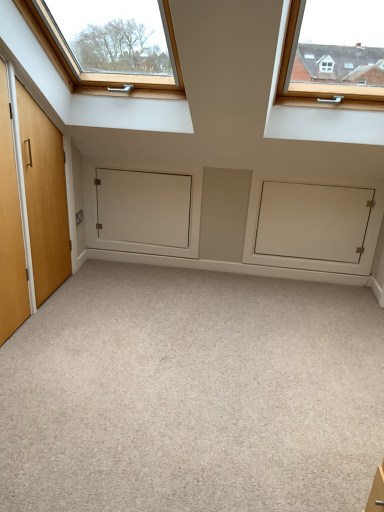
Describe the element at coordinates (143, 207) in the screenshot. I see `white matte door at center` at that location.

Where is `white matte cabinet at center`? This screenshot has height=512, width=384. white matte cabinet at center is located at coordinates (313, 221).

Could white matte cabinet at center be considered to be inside white matte door at center?

No, white matte cabinet at center is located outside of white matte door at center.

Can you tell me how much white matte door at center and white matte cabinet at center differ in facing direction?

They differ by 0.00222 degrees in their facing directions.

Is white matte door at center smaller than white matte cabinet at center?

Yes.

In terms of height, does white matte door at center look taller or shorter compared to white matte cabinet at center?

Clearly, white matte door at center is shorter compared to white matte cabinet at center.

Considering the sizes of objects white matte cabinet at center and carpet at center in the image provided, who is smaller, white matte cabinet at center or carpet at center?

white matte cabinet at center is smaller.

Can you tell me how much white matte cabinet at center and carpet at center differ in facing direction?

There is a 89.4-degree angle between the facing directions of white matte cabinet at center and carpet at center.

Considering the sizes of objects white matte cabinet at center and carpet at center in the image provided, who is wider, white matte cabinet at center or carpet at center?

With larger width is carpet at center.

Is there a large distance between white matte cabinet at center and white matte door at center?

No, white matte cabinet at center is not far away from white matte door at center.

Consider the image. From a real-world perspective, is white matte cabinet at center beneath white matte door at center?

Indeed, from a real-world perspective, white matte cabinet at center is positioned beneath white matte door at center.

Considering the sizes of white matte cabinet at center and white matte door at center in the image, is white matte cabinet at center wider or thinner than white matte door at center?

Clearly, white matte cabinet at center has more width compared to white matte door at center.

Which of these two, white matte cabinet at center or white matte door at center, stands shorter?

white matte door at center is shorter.

Between carpet at center and white matte door at center, which one appears on the left side from the viewer's perspective?

white matte door at center.

From the image's perspective, which one is positioned lower, carpet at center or white matte door at center?

From the image's view, carpet at center is below.

Does carpet at center have a lesser height compared to white matte door at center?

Yes, carpet at center is shorter than white matte door at center.

Which point is more distant from viewer, (288, 332) or (106, 176)?

The point (106, 176) is farther.

Is carpet at center surrounding white matte cabinet at center?

No, white matte cabinet at center is not inside carpet at center.

Which object is positioned more to the right, carpet at center or white matte cabinet at center?

Positioned to the right is white matte cabinet at center.

From the image's perspective, relative to white matte cabinet at center, is carpet at center above or below?

carpet at center is below white matte cabinet at center.

Based on the photo, is carpet at center closer to camera compared to white matte cabinet at center?

Yes, it is.

Measure the distance from white matte door at center to carpet at center.

white matte door at center is 1.15 meters from carpet at center.

Is white matte door at center turned away from carpet at center?

No, white matte door at center is not facing the opposite direction of carpet at center.

Does point (126, 212) come in front of point (345, 342)?

No, it is not.

Is white matte door at center closer to camera compared to carpet at center?

No, it is not.

Where is `cabinetry in front of the white matte door at center`? This screenshot has height=512, width=384. cabinetry in front of the white matte door at center is located at coordinates (313, 221).

You are a GUI agent. You are given a task and a screenshot of the screen. Output one action in this format:
    pyautogui.click(x=<x>, y=<y>)
    Task: Click on the cabinetry behind the carpet at center
    The width and height of the screenshot is (384, 512).
    Given the screenshot: What is the action you would take?
    [313, 221]

From the image, which object appears to be nearer to white matte door at center, carpet at center or white matte cabinet at center?

The object closer to white matte door at center is white matte cabinet at center.

Estimate the real-world distances between objects in this image. Which object is further from white matte cabinet at center, carpet at center or white matte door at center?

Among the two, carpet at center is located further to white matte cabinet at center.

Estimate the real-world distances between objects in this image. Which object is closer to carpet at center, white matte cabinet at center or white matte door at center?

The object closer to carpet at center is white matte cabinet at center.

Estimate the real-world distances between objects in this image. Which object is further from carpet at center, white matte door at center or white matte cabinet at center?

The object further to carpet at center is white matte door at center.

Which object lies nearer to the anchor point white matte door at center, white matte cabinet at center or carpet at center?

Among the two, white matte cabinet at center is located nearer to white matte door at center.

Looking at this image, which object lies further to the anchor point white matte cabinet at center, white matte door at center or carpet at center?

carpet at center lies further to white matte cabinet at center than the other object.

Where is `cabinetry located between carpet at center and white matte door at center in the depth direction`? cabinetry located between carpet at center and white matte door at center in the depth direction is located at coordinates (313, 221).